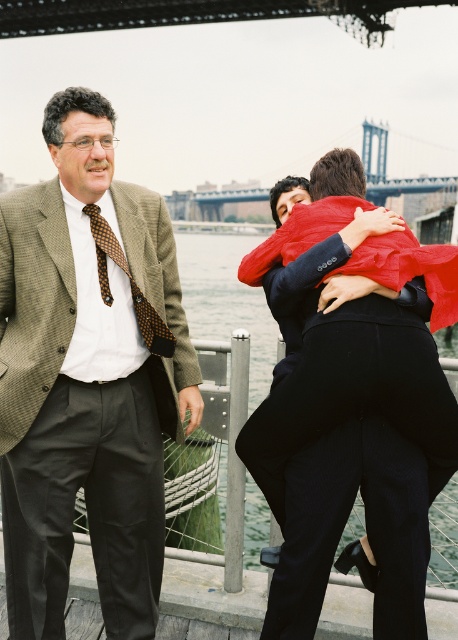
Question: Considering the relative positions of matte brown suit at left and metallic gray bridge at upper center in the image provided, where is matte brown suit at left located with respect to metallic gray bridge at upper center?

Choices:
 (A) below
 (B) above

Answer: (A)

Question: Which point is farther to the camera?

Choices:
 (A) velvet red coat at center
 (B) matte brown suit at left
 (C) metallic gray bridge at upper center
 (D) brown dotted tie at left

Answer: (C)

Question: Is velvet red coat at center behind brown dotted tie at left?

Choices:
 (A) no
 (B) yes

Answer: (A)

Question: Which of the following is the closest to the observer?

Choices:
 (A) (101, 243)
 (B) (96, 435)
 (C) (7, 29)

Answer: (B)

Question: Among these objects, which one is farthest from the camera?

Choices:
 (A) velvet red coat at center
 (B) matte brown suit at left
 (C) brown dotted tie at left
 (D) metallic gray bridge at upper center

Answer: (D)

Question: Is velvet red coat at center positioned behind metallic gray bridge at upper center?

Choices:
 (A) yes
 (B) no

Answer: (B)